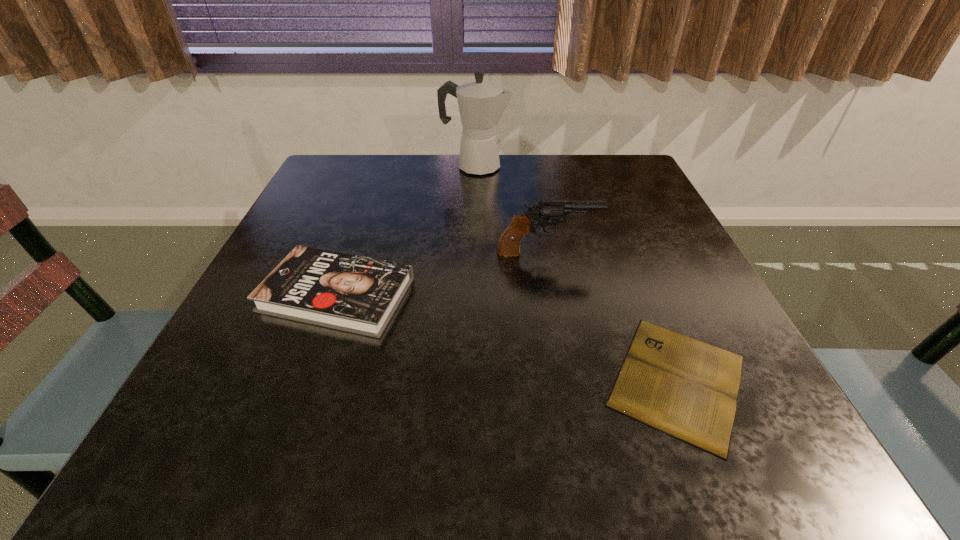
This screenshot has width=960, height=540. In the image, there is a desktop. Find the location of `vacant space at the right edge`. vacant space at the right edge is located at coordinates (632, 293).

You are a GUI agent. You are given a task and a screenshot of the screen. Output one action in this format:
    pyautogui.click(x=<x>, y=<y>)
    Task: Click on the free location at the far left corner
    
    Given the screenshot: What is the action you would take?
    pyautogui.click(x=384, y=159)

In the image, there is a desktop. Identify the location of free space at the far right corner. This screenshot has height=540, width=960. (636, 168).

Identify the location of vacant space in between the leftmost object and the coffeepot. (406, 231).

You are a GUI agent. You are given a task and a screenshot of the screen. Output one action in this format:
    pyautogui.click(x=<x>, y=<y>)
    Task: Click on the unoccupied position between the third tallest object and the farthest object
    This screenshot has width=960, height=540.
    Given the screenshot: What is the action you would take?
    pyautogui.click(x=406, y=231)

What are the coordinates of `blank region between the leftmost object and the farthest object` in the screenshot? It's located at (406, 231).

Where is `free area in between the shorter book and the farthest object`? This screenshot has width=960, height=540. free area in between the shorter book and the farthest object is located at coordinates (576, 273).

This screenshot has height=540, width=960. Identify the location of empty location between the right book and the leftmost object. point(507,338).

Locate an element on the screen. Image resolution: width=960 pixels, height=540 pixels. vacant area that lies between the gun and the shortest object is located at coordinates tap(612, 316).

In order to click on empty space that is in between the leftmost object and the gun in this screenshot , I will do `click(442, 274)`.